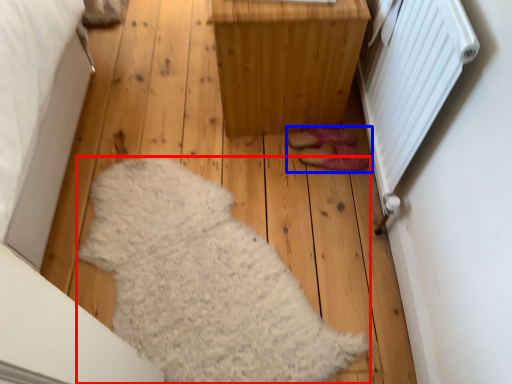
Question: Which object appears farthest to the camera in this image, blanket (highlighted by a red box) or footwear (highlighted by a blue box)?

Choices:
 (A) blanket
 (B) footwear

Answer: (B)